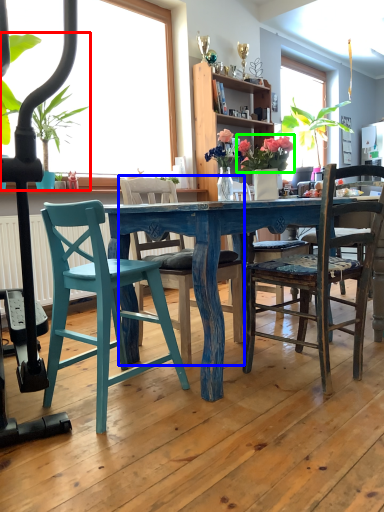
Question: Which object is the farthest from houseplant (highlighted by a red box)? Choose among these: chair (highlighted by a blue box) or floral arrangement (highlighted by a green box).

Choices:
 (A) chair
 (B) floral arrangement

Answer: (B)